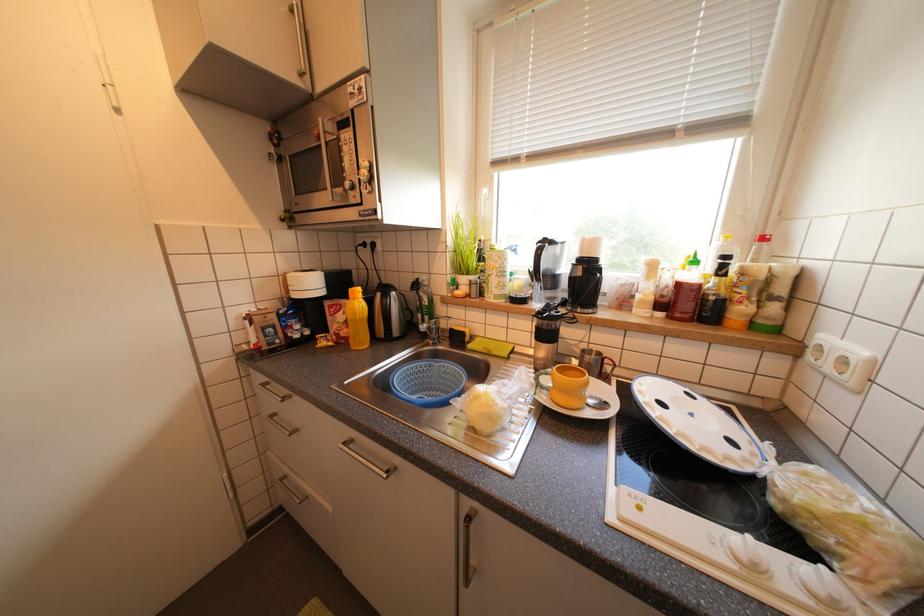
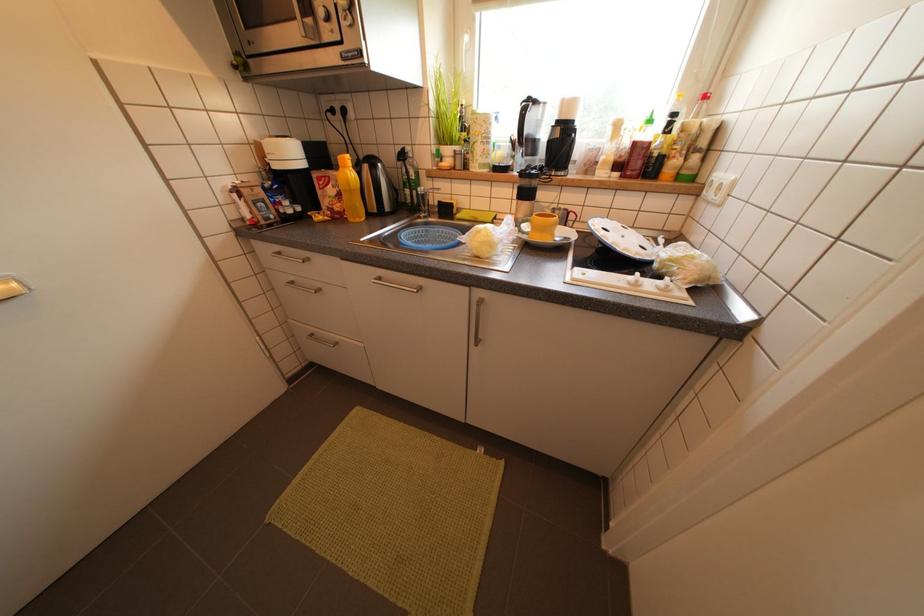
Question: The images are taken continuously from a first-person perspective. In which direction is your viewpoint rotating?

Choices:
 (A) Left
 (B) Right
 (C) Up
 (D) Down

Answer: (D)